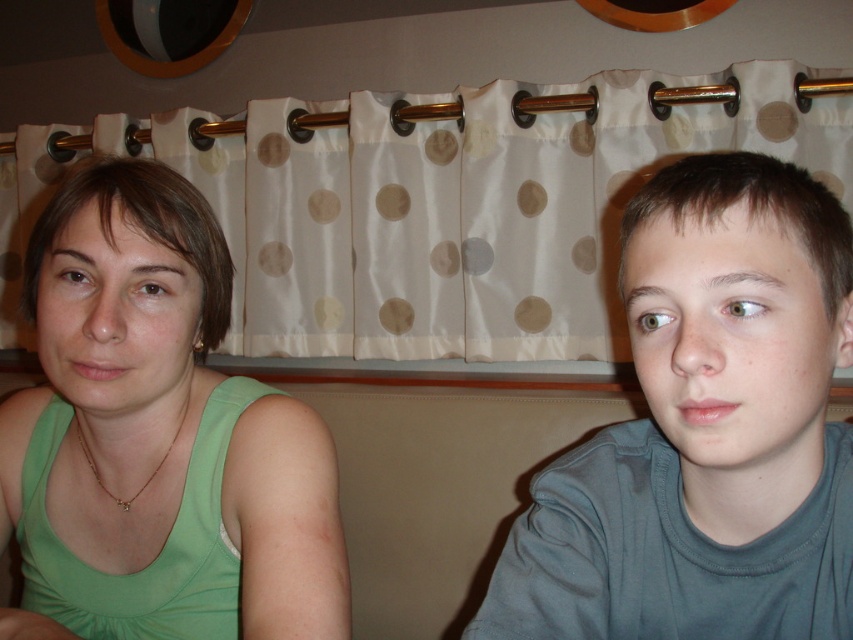
You are a fashion designer observing two people in a cafe. You notice the gray cotton shirt at right and the green fabric tank top at left. Which clothing item is positioned more to the east side of the room?

The gray cotton shirt at right is positioned more to the east side of the room because it is to the right of the green fabric tank top at left, assuming the observer is facing north.

You are a photographer trying to capture a closeup of the gray cotton shirt at right. Based on the coordinates provided, where should you position your camera relative to the subject?

The gray cotton shirt at right is located at coordinates point (705, 429). To capture a closeup, position the camera directly facing the shirt at that coordinate point.

You are a window cleaner standing in front of the window with the white polka dot fabric at upper center and the gray cotton shirt at right. The fabric is blocking your view. Can you tell which object is higher up?

The white polka dot fabric at upper center is taller than the gray cotton shirt at right, so the fabric is higher up.